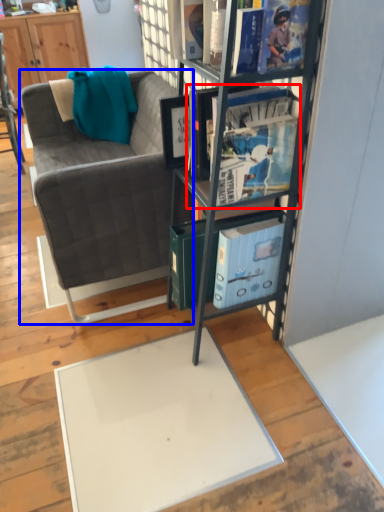
Question: Which of the following is the closest to the observer, book (highlighted by a red box) or studio couch (highlighted by a blue box)?

Choices:
 (A) book
 (B) studio couch

Answer: (A)